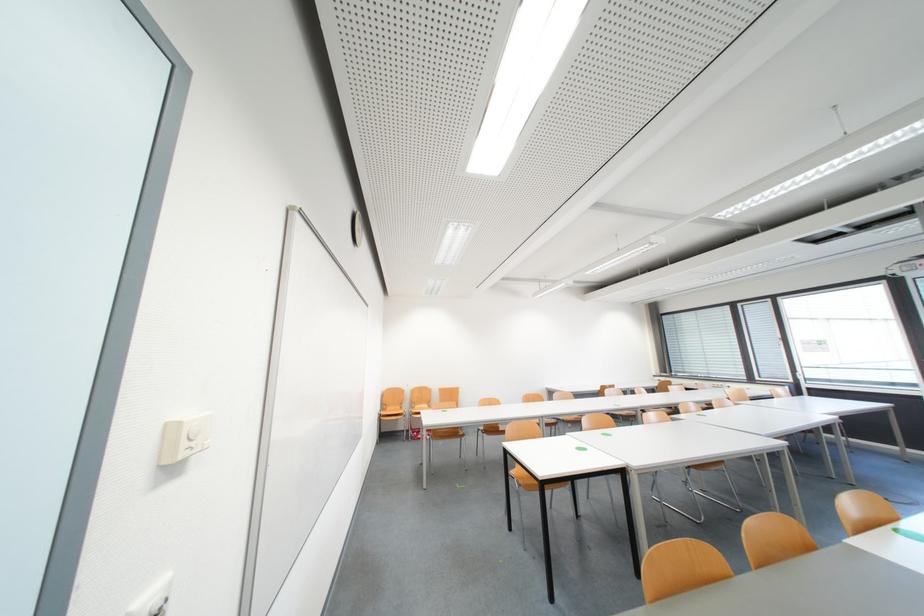
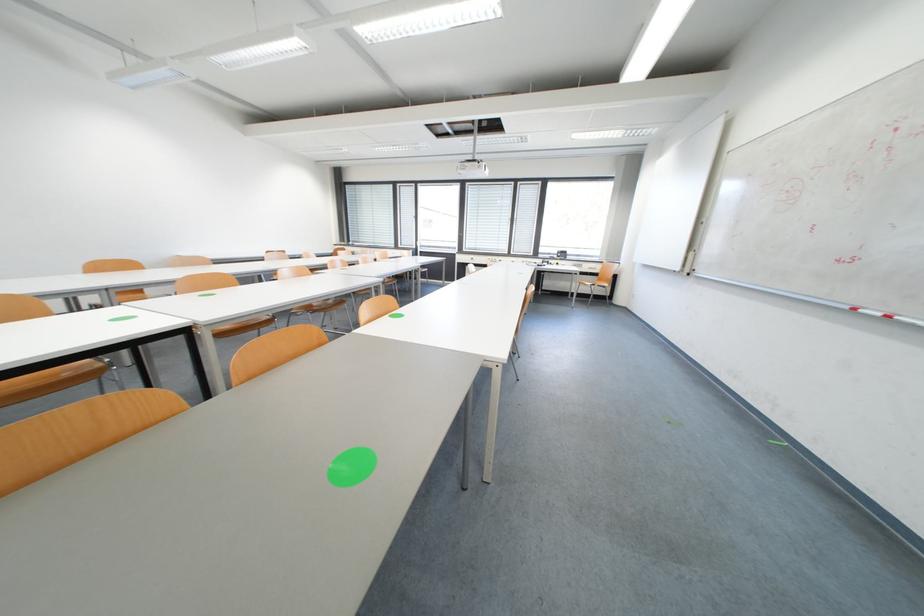
The first image is from the beginning of the video and the second image is from the end. How did the camera likely rotate when shooting the video?

The camera rotated toward right-down.